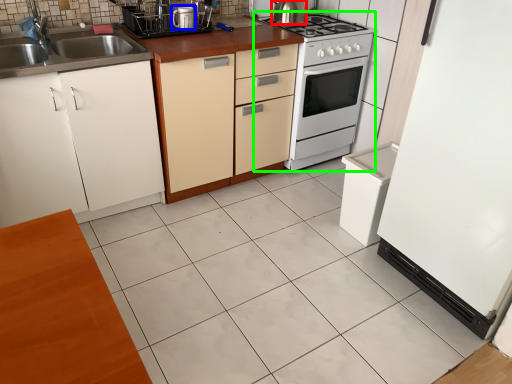
Question: Which is farther away from kitchen appliance (highlighted by a red box)? kitchen appliance (highlighted by a blue box) or home appliance (highlighted by a green box)?

Choices:
 (A) kitchen appliance
 (B) home appliance

Answer: (A)